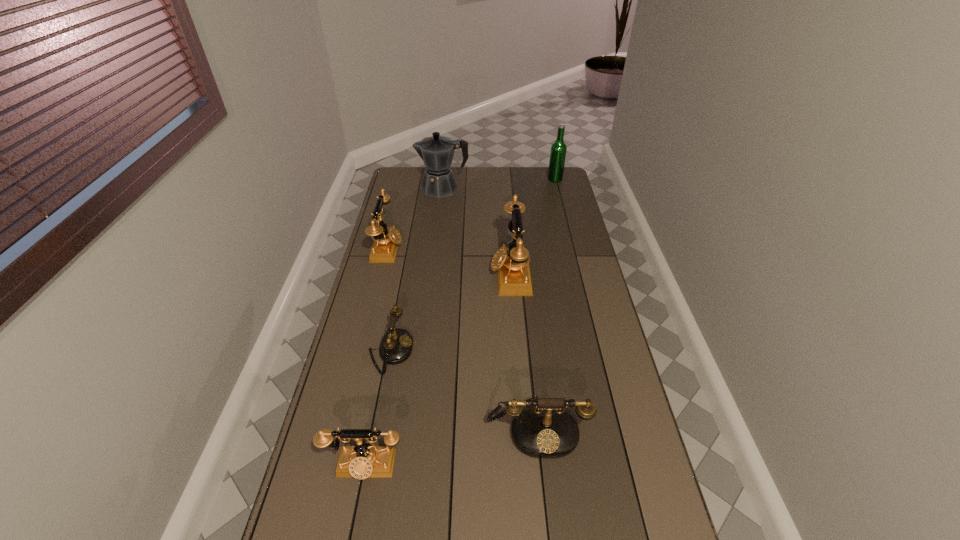
Find the location of a particular element. The height and width of the screenshot is (540, 960). beige telephone that is the second closest to the second tallest telephone is located at coordinates point(361,461).

This screenshot has width=960, height=540. Find the location of `beige telephone that can be found as the closest to the rightmost beige telephone`. beige telephone that can be found as the closest to the rightmost beige telephone is located at coordinates (386, 241).

Where is `vacant point that satisfies the following two spatial constraints: 1. on the dial of the biggest beige telephone; 2. on the dial of the smallest beige telephone`? vacant point that satisfies the following two spatial constraints: 1. on the dial of the biggest beige telephone; 2. on the dial of the smallest beige telephone is located at coordinates (525, 466).